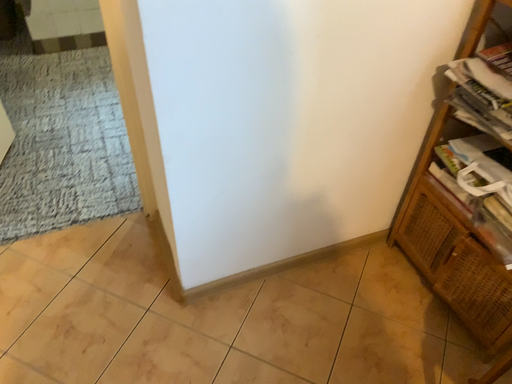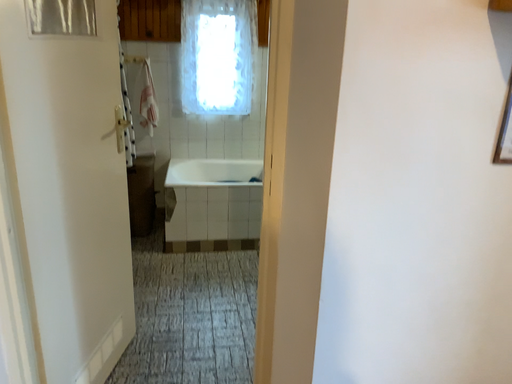
Question: Which way did the camera rotate in the video?

Choices:
 (A) rotated right
 (B) rotated left

Answer: (B)